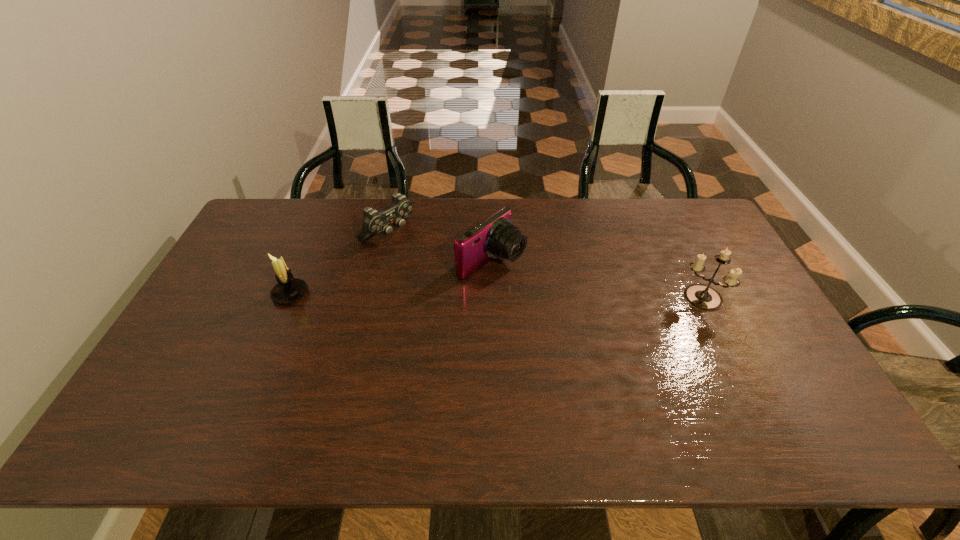
Locate an element on the screen. The image size is (960, 540). vacant space positioned on the front-facing side of the third object from left to right is located at coordinates (577, 311).

Where is `vacant space located on the front-facing side of the third object from left to right`? vacant space located on the front-facing side of the third object from left to right is located at coordinates (624, 339).

You are a GUI agent. You are given a task and a screenshot of the screen. Output one action in this format:
    pyautogui.click(x=<x>, y=<y>)
    Task: Click on the object present at the far edge
    The height and width of the screenshot is (540, 960).
    Given the screenshot: What is the action you would take?
    pyautogui.click(x=374, y=222)

I want to click on object situated at the right edge, so click(x=702, y=297).

Locate an element on the screen. Image resolution: width=960 pixels, height=540 pixels. free point at the far edge is located at coordinates (314, 218).

In the image, there is a desktop. What are the coordinates of `free space at the near edge` in the screenshot? It's located at (428, 389).

The width and height of the screenshot is (960, 540). I want to click on vacant space at the left edge of the desktop, so click(251, 308).

This screenshot has height=540, width=960. What are the coordinates of `free space at the right edge` in the screenshot? It's located at (683, 241).

In the image, there is a desktop. Identify the location of free region at the far left corner. The width and height of the screenshot is (960, 540). (266, 214).

The width and height of the screenshot is (960, 540). Find the location of `blank space at the near left corner of the desktop`. blank space at the near left corner of the desktop is located at coordinates (158, 381).